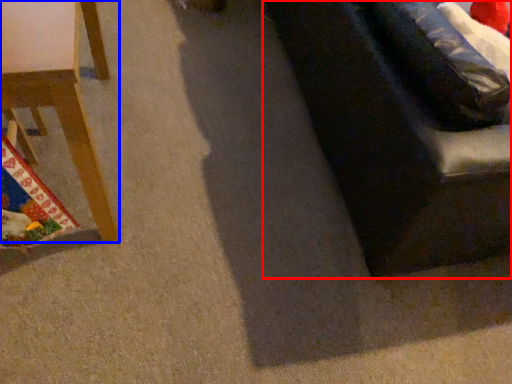
Question: Which object appears farthest to the camera in this image, studio couch (highlighted by a red box) or furniture (highlighted by a blue box)?

Choices:
 (A) studio couch
 (B) furniture

Answer: (A)